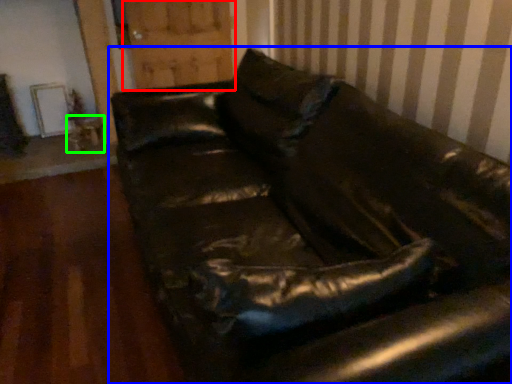
Question: Estimate the real-world distances between objects in this image. Which object is closer to barn door (highlighted by a red box), studio couch (highlighted by a blue box) or table (highlighted by a green box)?

Choices:
 (A) studio couch
 (B) table

Answer: (B)